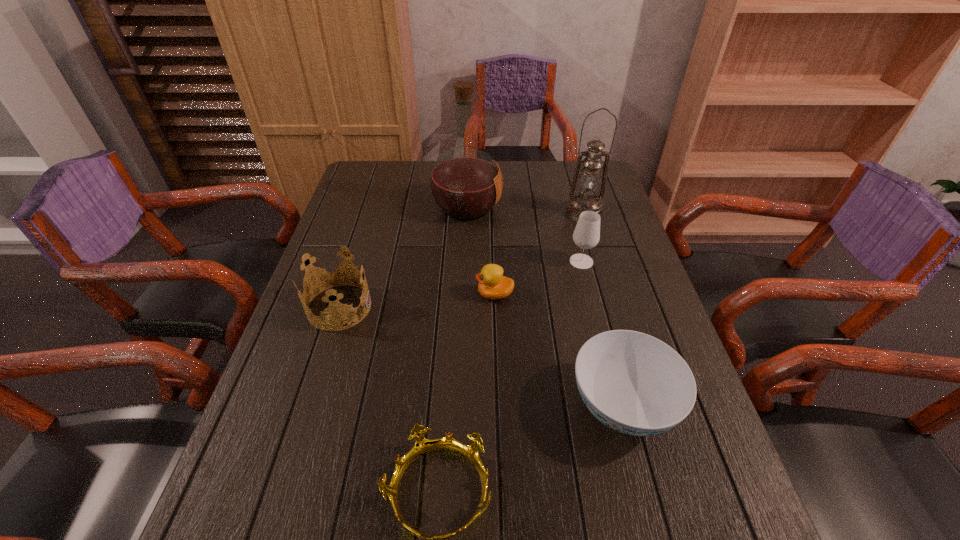
What are the coordinates of `liquor` in the screenshot? It's located at pos(466,183).

Locate an element on the screen. The image size is (960, 540). oil lamp is located at coordinates (589, 180).

Identify the location of the third farthest object. Image resolution: width=960 pixels, height=540 pixels. (586, 235).

This screenshot has width=960, height=540. Identify the location of the leftmost object. (336, 309).

At what (x,y) coordinates should I click in order to perform the action: click on the left crown. Please return your answer as a coordinate pair (x, y). The width and height of the screenshot is (960, 540). Looking at the image, I should click on (336, 309).

At what (x,y) coordinates should I click in order to perform the action: click on chinaware. Please return your answer as a coordinate pair (x, y). This screenshot has width=960, height=540. Looking at the image, I should click on (634, 383).

At what (x,y) coordinates should I click in order to perform the action: click on the second shortest object. Please return your answer as a coordinate pair (x, y). Image resolution: width=960 pixels, height=540 pixels. Looking at the image, I should click on (492, 284).

This screenshot has width=960, height=540. In order to click on free region located on the front label of the liquor in this screenshot , I will do `click(544, 207)`.

Where is `vacant space located on the front of the oil lamp`? This screenshot has width=960, height=540. vacant space located on the front of the oil lamp is located at coordinates (591, 238).

What are the coordinates of `free region located 0.270m on the left of the glass` in the screenshot? It's located at (475, 261).